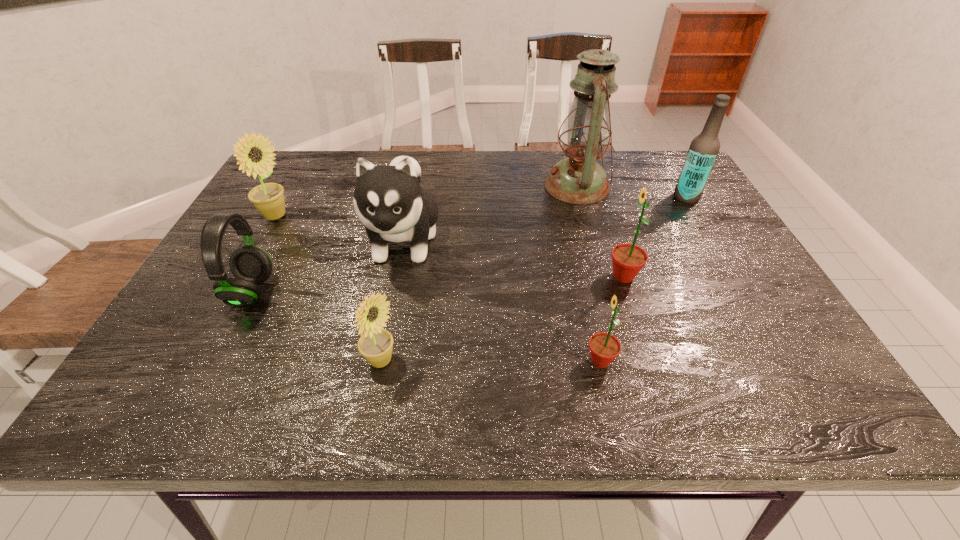
Locate an element on the screen. free space that satisfies the following two spatial constraints: 1. on the label of the beer bottle; 2. at the face of the white puppy is located at coordinates (711, 240).